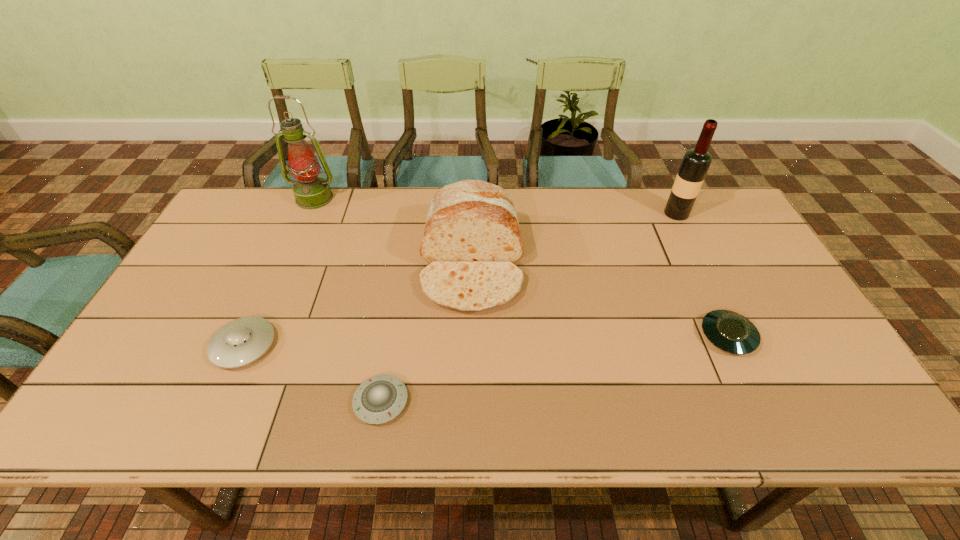
Find the location of a particular element. The width and height of the screenshot is (960, 540). free space at the far edge of the desktop is located at coordinates (563, 188).

In order to click on free space at the near edge in this screenshot , I will do `click(518, 407)`.

In the image, there is a desktop. Find the location of `vacant area at the left edge`. vacant area at the left edge is located at coordinates (202, 258).

Where is `free location at the right edge`? This screenshot has width=960, height=540. free location at the right edge is located at coordinates (809, 360).

Image resolution: width=960 pixels, height=540 pixels. I want to click on vacant space at the far right corner of the desktop, so click(740, 231).

I want to click on vacant area between the oil lamp and the rightmost saucer, so coord(521,267).

I want to click on vacant area that lies between the leftmost saucer and the oil lamp, so click(x=279, y=272).

The image size is (960, 540). What are the coordinates of `free space between the oil lamp and the bread` in the screenshot? It's located at (394, 231).

This screenshot has width=960, height=540. Find the location of `free space that is in between the leftmost saucer and the bread`. free space that is in between the leftmost saucer and the bread is located at coordinates (358, 305).

Locate an element on the screen. Image resolution: width=960 pixels, height=540 pixels. free spot between the leftmost saucer and the oil lamp is located at coordinates (279, 272).